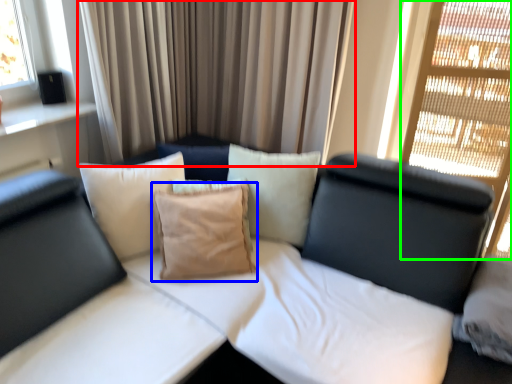
Question: Based on their relative distances, which object is farther from curtain (highlighted by a red box)? Choose from pillow (highlighted by a blue box) and glass door (highlighted by a green box).

Choices:
 (A) pillow
 (B) glass door

Answer: (B)